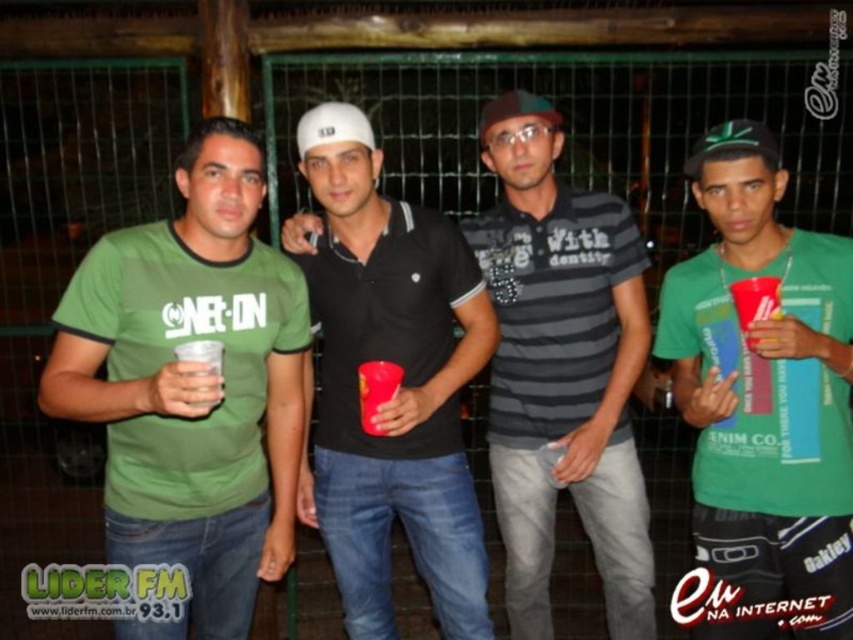
Question: In this image, where is black cotton polo shirt at center located relative to clear plastic cup at center?

Choices:
 (A) left
 (B) right

Answer: (B)

Question: Does green matte t-shirt at center appear under striped cotton shirt at center?

Choices:
 (A) yes
 (B) no

Answer: (A)

Question: Is green matte t-shirt at center in front of black cotton polo shirt at center?

Choices:
 (A) yes
 (B) no

Answer: (A)

Question: Considering the real-world distances, which object is farthest from the striped cotton shirt at center?

Choices:
 (A) green matte t-shirt at center
 (B) green cotton t-shirt at left

Answer: (B)

Question: Among these points, which one is nearest to the camera?

Choices:
 (A) (96, 362)
 (B) (459, 628)
 (C) (210, 404)

Answer: (C)

Question: Which of the following is the closest to the observer?

Choices:
 (A) (236, 531)
 (B) (381, 369)
 (C) (218, 360)

Answer: (C)